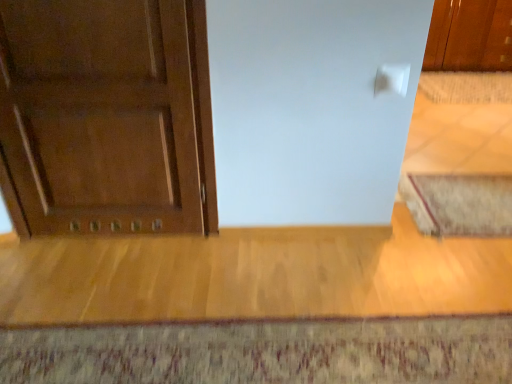
Identify the location of free spot in front of matte wood door at left. This screenshot has height=384, width=512. (103, 279).